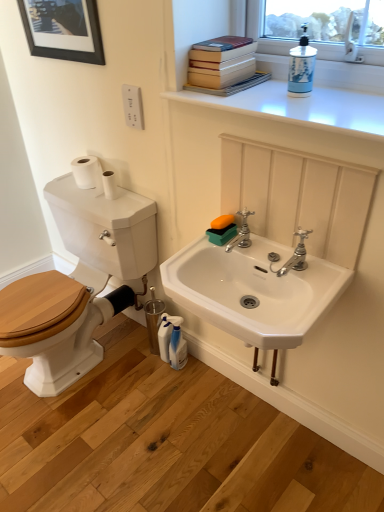
Question: From their relative heights in the image, would you say hardcover books at upper right is taller or shorter than white glossy counter top at upper center?

Choices:
 (A) short
 (B) tall

Answer: (B)

Question: From a real-world perspective, is hardcover books at upper right positioned above or below white glossy counter top at upper center?

Choices:
 (A) above
 (B) below

Answer: (A)

Question: Based on their relative distances, which object is nearer to the hardcover books at upper right?

Choices:
 (A) silver metallic faucet at center, marked as the second tap in a right-to-left arrangement
 (B) white matte toilet paper at upper left
 (C) woodenmaterial/texturetoilet at left
 (D) white glossy soap dispenser at upper right, marked as the 1th cleaning product in a front-to-back arrangement
 (E) white plastic spray bottle at lower center, the first cleaning product positioned from the back

Answer: (D)

Question: Which object is the farthest from the silver metallic faucet at center, marked as the second tap in a right-to-left arrangement?

Choices:
 (A) white ceramic sink at center
 (B) woodenmaterial/texturetoilet at left
 (C) black matte picture frame at upper left
 (D) white plastic spray bottle at lower center, positioned as the second cleaning product in front-to-back order
 (E) white matte toilet paper at upper left

Answer: (C)